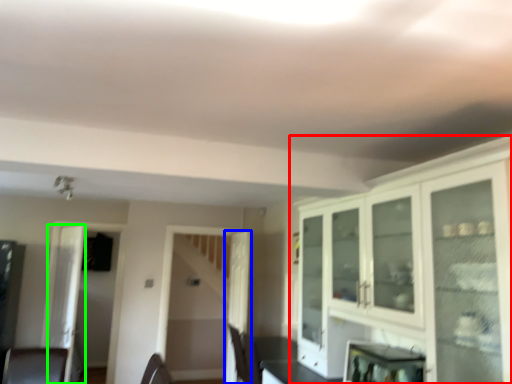
Question: Which object is the closest to the cabinetry (highlighted by a red box)? Choose among these: door (highlighted by a blue box) or glass door (highlighted by a green box).

Choices:
 (A) door
 (B) glass door

Answer: (A)